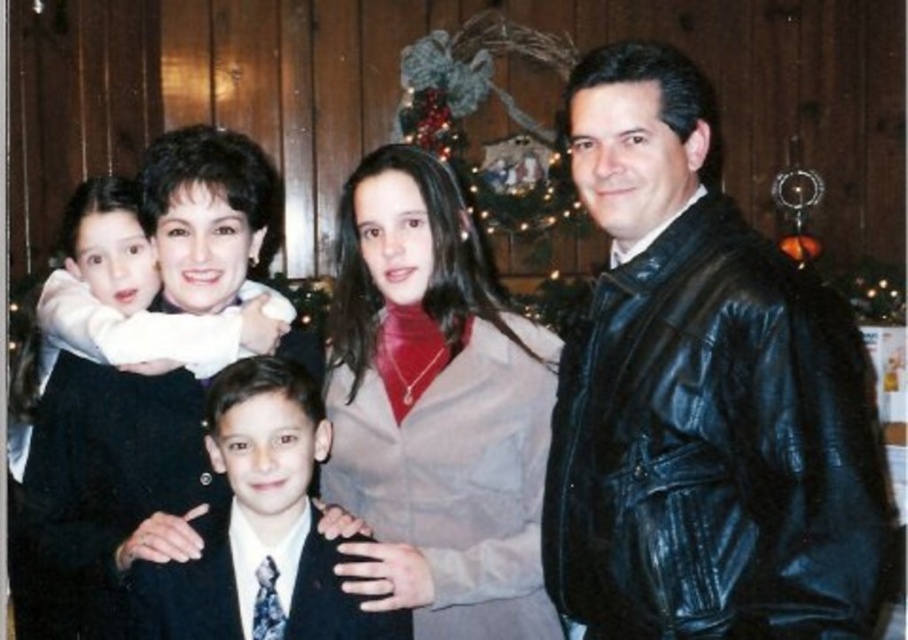
Can you confirm if black leather jacket at right is bigger than dark blue suit at center?

Yes, black leather jacket at right is bigger than dark blue suit at center.

Who is positioned more to the right, black leather jacket at right or dark blue suit at center?

From the viewer's perspective, black leather jacket at right appears more on the right side.

Is point (721, 214) closer to camera compared to point (252, 417)?

Yes, it is in front of point (252, 417).

Identify the location of black leather jacket at right. The height and width of the screenshot is (640, 908). (702, 397).

Does black leather jacket at right lie behind matte black suit at left?

No, black leather jacket at right is in front of matte black suit at left.

What do you see at coordinates (702, 397) in the screenshot? This screenshot has height=640, width=908. I see `black leather jacket at right` at bounding box center [702, 397].

Identify the location of black leather jacket at right. (702, 397).

Between matte black suit at left and dark blue suit at center, which one is positioned lower?

Positioned lower is dark blue suit at center.

Does point (123, 257) lie behind point (252, 474)?

Yes, point (123, 257) is farther from viewer.

I want to click on matte black suit at left, so click(x=87, y=406).